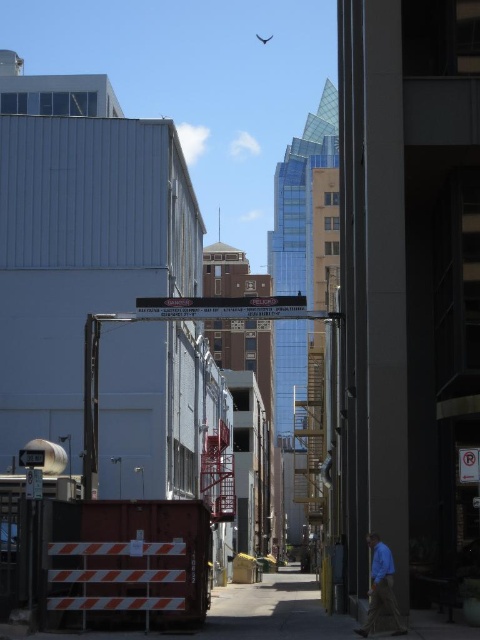
Is blue cotton shirt at lower right bigger than transparent plastic fly at upper center?

Actually, blue cotton shirt at lower right might be smaller than transparent plastic fly at upper center.

Who is shorter, blue cotton shirt at lower right or transparent plastic fly at upper center?

With less height is blue cotton shirt at lower right.

Between point (384, 563) and point (264, 38), which one is positioned behind?

The point (264, 38) is more distant.

At what (x,y) coordinates should I click in order to perform the action: click on blue cotton shirt at lower right. Please return your answer as a coordinate pair (x, y). Looking at the image, I should click on (381, 588).

Is orange striped barrier at lower left to the right of transparent plastic fly at upper center from the viewer's perspective?

In fact, orange striped barrier at lower left is to the left of transparent plastic fly at upper center.

Who is positioned more to the right, orange striped barrier at lower left or transparent plastic fly at upper center?

Positioned to the right is transparent plastic fly at upper center.

Is point (236, 589) closer to viewer compared to point (271, 36)?

That is True.

This screenshot has height=640, width=480. What are the coordinates of `orange striped barrier at lower left` in the screenshot? It's located at (241, 616).

Between orange striped barrier at lower left and blue cotton shirt at lower right, which one is positioned lower?

orange striped barrier at lower left

Is point (276, 584) in front of point (385, 576)?

No, (276, 584) is further to viewer.

Where is `orange striped barrier at lower left`? orange striped barrier at lower left is located at coordinates pyautogui.click(x=241, y=616).